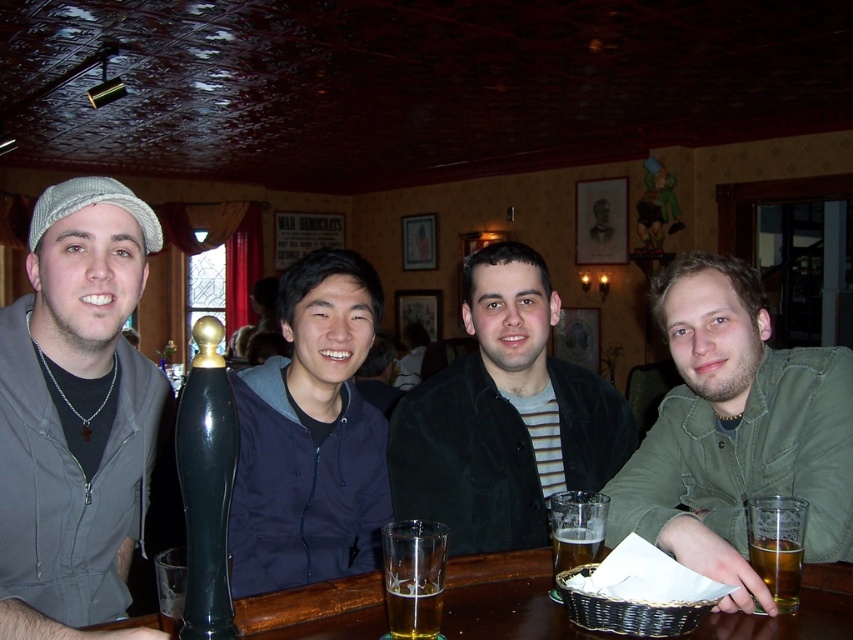
You are a bartender preparing drinks for the group. You have a matte gray cap at left and a golden amber liquid at lower right. Which object is taller?

The matte gray cap at left is taller than the golden amber liquid at lower right according to the description.

You are a photographer standing at the back of the pub. You want to take a photo of the dark green jacket at center but the matte gray cap at left is blocking your view. Can you adjust your position to avoid the cap?

The matte gray cap at left is much taller than the dark green jacket at center, so you should lower your camera angle to avoid the cap blocking the view of the dark green jacket at center.